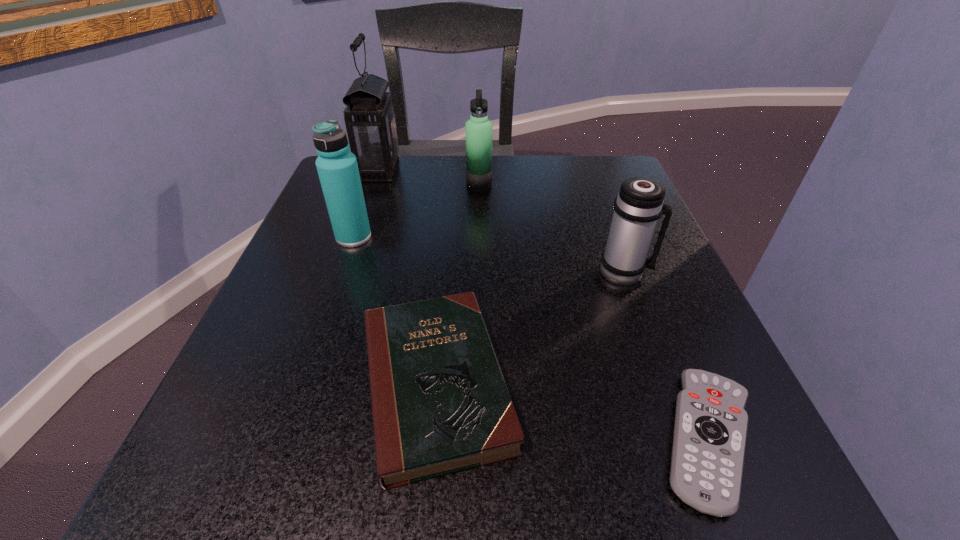
I want to click on free space located 0.210m on the right of the farthest thermos bottle, so click(x=587, y=185).

Where is `vacant space located 0.200m on the right of the Bible`? This screenshot has width=960, height=540. vacant space located 0.200m on the right of the Bible is located at coordinates (666, 383).

What are the coordinates of `vacant space located on the left of the remote control` in the screenshot? It's located at (514, 438).

Where is `lantern located at the far edge`? The width and height of the screenshot is (960, 540). lantern located at the far edge is located at coordinates tap(370, 122).

The width and height of the screenshot is (960, 540). I want to click on thermos bottle at the far edge, so click(479, 129).

Where is `Bible present at the near edge`? This screenshot has width=960, height=540. Bible present at the near edge is located at coordinates (440, 404).

Locate an element on the screen. The width and height of the screenshot is (960, 540). remote control that is positioned at the near edge is located at coordinates (710, 430).

The height and width of the screenshot is (540, 960). I want to click on lantern that is at the left edge, so click(370, 122).

Where is `thermos bottle at the left edge`? thermos bottle at the left edge is located at coordinates (337, 167).

Where is `thermos bottle located in the right edge section of the desktop`? The image size is (960, 540). thermos bottle located in the right edge section of the desktop is located at coordinates (639, 204).